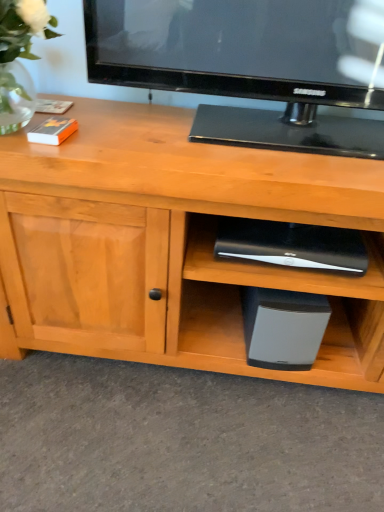
Question: Is black plastic speaker at lower center, placed as the 1th appliance when sorted from top to bottom, located within black matte speaker at lower center, which is the first appliance in bottom-to-top order?

Choices:
 (A) yes
 (B) no

Answer: (B)

Question: Is black matte speaker at lower center, which is the first appliance in bottom-to-top order, next to black plastic speaker at lower center, placed as the 1th appliance when sorted from top to bottom?

Choices:
 (A) yes
 (B) no

Answer: (B)

Question: From the image's perspective, is black matte speaker at lower center, the 2th appliance in the top-to-bottom sequence, above black plastic speaker at lower center, the second appliance when ordered from bottom to top?

Choices:
 (A) yes
 (B) no

Answer: (B)

Question: Is black matte speaker at lower center, the 2th appliance in the top-to-bottom sequence, wider than black plastic speaker at lower center, the second appliance when ordered from bottom to top?

Choices:
 (A) yes
 (B) no

Answer: (A)

Question: Can you confirm if black matte speaker at lower center, which is the first appliance in bottom-to-top order, is smaller than black plastic speaker at lower center, placed as the 1th appliance when sorted from top to bottom?

Choices:
 (A) no
 (B) yes

Answer: (A)

Question: From a real-world perspective, is black plastic speaker at lower center, placed as the 1th appliance when sorted from top to bottom, physically located above or below clear glass vase at upper left?

Choices:
 (A) above
 (B) below

Answer: (B)

Question: In terms of size, does black plastic speaker at lower center, placed as the 1th appliance when sorted from top to bottom, appear bigger or smaller than clear glass vase at upper left?

Choices:
 (A) small
 (B) big

Answer: (A)

Question: Is black plastic speaker at lower center, the second appliance when ordered from bottom to top, taller or shorter than clear glass vase at upper left?

Choices:
 (A) tall
 (B) short

Answer: (B)

Question: In terms of width, does black plastic speaker at lower center, placed as the 1th appliance when sorted from top to bottom, look wider or thinner when compared to clear glass vase at upper left?

Choices:
 (A) wide
 (B) thin

Answer: (B)

Question: From the image's perspective, relative to clear glass vase at upper left, is black matte speaker at lower center, the 2th appliance in the top-to-bottom sequence, above or below?

Choices:
 (A) below
 (B) above

Answer: (A)

Question: In terms of size, does black matte speaker at lower center, which is the first appliance in bottom-to-top order, appear bigger or smaller than clear glass vase at upper left?

Choices:
 (A) small
 (B) big

Answer: (A)

Question: From their relative heights in the image, would you say black matte speaker at lower center, which is the first appliance in bottom-to-top order, is taller or shorter than clear glass vase at upper left?

Choices:
 (A) tall
 (B) short

Answer: (B)

Question: Considering the positions of point (304, 334) and point (13, 112), is point (304, 334) closer or farther from the camera than point (13, 112)?

Choices:
 (A) farther
 (B) closer

Answer: (A)

Question: Considering the relative positions of black plastic speaker at lower center, placed as the 1th appliance when sorted from top to bottom, and black matte speaker at lower center, the 2th appliance in the top-to-bottom sequence, in the image provided, is black plastic speaker at lower center, placed as the 1th appliance when sorted from top to bottom, to the left or to the right of black matte speaker at lower center, the 2th appliance in the top-to-bottom sequence,?

Choices:
 (A) left
 (B) right

Answer: (A)

Question: Considering the positions of black plastic speaker at lower center, placed as the 1th appliance when sorted from top to bottom, and black matte speaker at lower center, the 2th appliance in the top-to-bottom sequence, in the image, is black plastic speaker at lower center, placed as the 1th appliance when sorted from top to bottom, wider or thinner than black matte speaker at lower center, the 2th appliance in the top-to-bottom sequence,?

Choices:
 (A) thin
 (B) wide

Answer: (A)